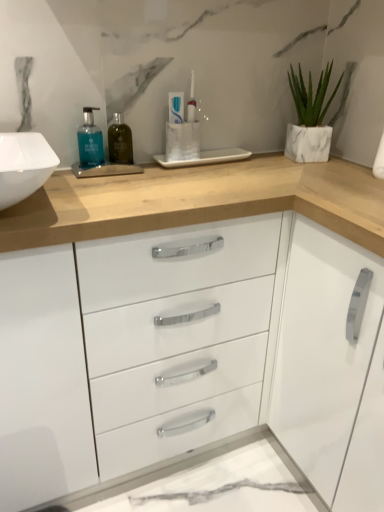
Question: Would you say blue glass bottle at upper left, which is counted as the second mouthwash, starting from the right, is to the left or to the right of white marble planter at upper right in the picture?

Choices:
 (A) right
 (B) left

Answer: (B)

Question: From the image's perspective, is blue glass bottle at upper left, positioned as the 1th mouthwash in left-to-right order, located above or below white marble planter at upper right?

Choices:
 (A) above
 (B) below

Answer: (B)

Question: Which is farther from the blue glass bottle at upper left, which is counted as the second mouthwash, starting from the right?

Choices:
 (A) green glass bottle at center, which appears as the 2th mouthwash when viewed from the left
 (B) white marble planter at upper right
 (C) white glossy cabinet handle at right
 (D) white glossy toothpaste at center

Answer: (C)

Question: Which object is the farthest from the white glossy cabinet handle at right?

Choices:
 (A) green glass bottle at center, which appears as the 2th mouthwash when viewed from the left
 (B) blue glass bottle at upper left, positioned as the 1th mouthwash in left-to-right order
 (C) white glossy toothpaste at center
 (D) white marble planter at upper right

Answer: (B)